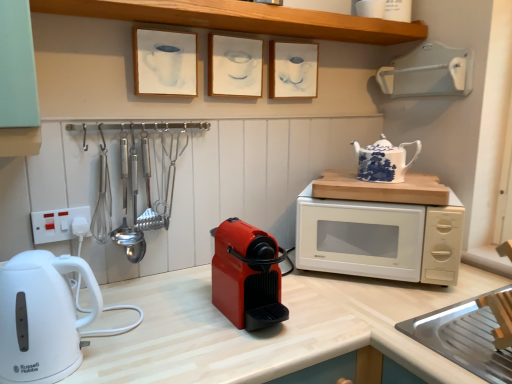
Question: Is wooden at upper center facing away from matte plastic coffee machine at center, which is the first home appliance in right-to-left order?

Choices:
 (A) yes
 (B) no

Answer: (B)

Question: Is wooden at upper center at the right side of matte plastic coffee machine at center, the 2th home appliance when ordered from left to right?

Choices:
 (A) no
 (B) yes

Answer: (B)

Question: Can you confirm if wooden at upper center is taller than matte plastic coffee machine at center, which is the first home appliance in right-to-left order?

Choices:
 (A) no
 (B) yes

Answer: (A)

Question: Is wooden at upper center to the left of matte plastic coffee machine at center, the 2th home appliance when ordered from left to right, from the viewer's perspective?

Choices:
 (A) no
 (B) yes

Answer: (A)

Question: Is wooden at upper center further to the viewer compared to matte plastic coffee machine at center, the 2th home appliance when ordered from left to right?

Choices:
 (A) no
 (B) yes

Answer: (B)

Question: In the image, is white paper picture frame at upper center, marked as the 1th picture frame in a left-to-right arrangement, positioned in front of or behind matte white picture frame at center, the second picture frame viewed from the left?

Choices:
 (A) behind
 (B) front

Answer: (B)

Question: Considering the positions of white paper picture frame at upper center, which is counted as the third picture frame, starting from the right, and matte white picture frame at center, positioned as the 2th picture frame in right-to-left order, in the image, is white paper picture frame at upper center, which is counted as the third picture frame, starting from the right, wider or thinner than matte white picture frame at center, positioned as the 2th picture frame in right-to-left order,?

Choices:
 (A) thin
 (B) wide

Answer: (B)

Question: In terms of height, does white paper picture frame at upper center, which is counted as the third picture frame, starting from the right, look taller or shorter compared to matte white picture frame at center, positioned as the 2th picture frame in right-to-left order?

Choices:
 (A) tall
 (B) short

Answer: (A)

Question: Considering the positions of point (181, 41) and point (208, 54), is point (181, 41) closer or farther from the camera than point (208, 54)?

Choices:
 (A) farther
 (B) closer

Answer: (B)

Question: In the image, is white plastic electric outlet at left on the left side or the right side of blue and white porcelain teapot at upper right?

Choices:
 (A) right
 (B) left

Answer: (B)

Question: Is white plastic electric outlet at left taller or shorter than blue and white porcelain teapot at upper right?

Choices:
 (A) short
 (B) tall

Answer: (A)

Question: From a real-world perspective, is white plastic electric outlet at left above or below blue and white porcelain teapot at upper right?

Choices:
 (A) above
 (B) below

Answer: (B)

Question: Is white plastic electric outlet at left spatially inside blue and white porcelain teapot at upper right, or outside of it?

Choices:
 (A) inside
 (B) outside

Answer: (B)

Question: Considering their positions, is wooden at upper center located in front of or behind white paper picture frame at upper center, which is counted as the third picture frame, starting from the right?

Choices:
 (A) front
 (B) behind

Answer: (A)

Question: Is wooden at upper center to the left or to the right of white paper picture frame at upper center, marked as the 1th picture frame in a left-to-right arrangement, in the image?

Choices:
 (A) right
 (B) left

Answer: (A)